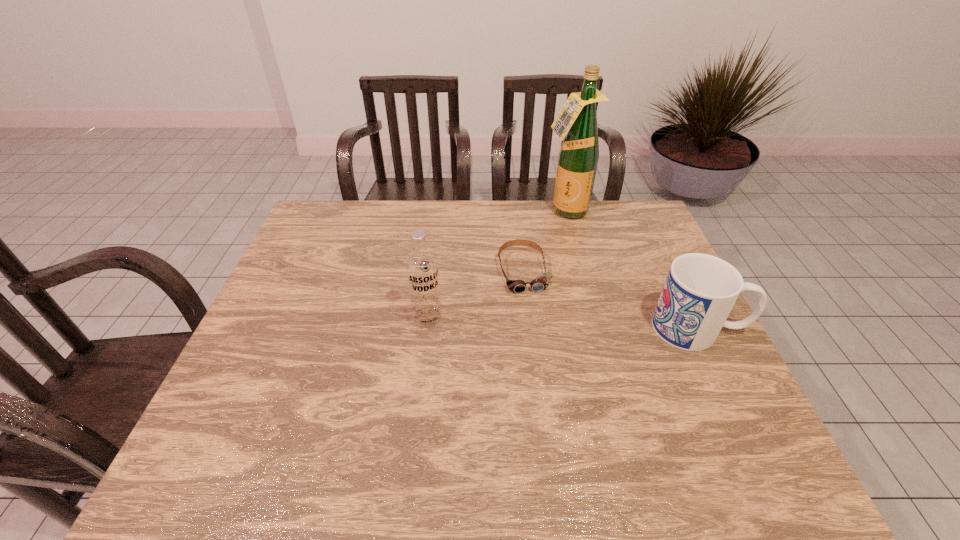
Locate an element on the screen. vacant space on the desktop that is between the leftmost object and the rightmost object and is positioned on the front-facing side of the goggles is located at coordinates click(538, 322).

Where is `free spot on the desktop that is between the third shortest object and the rightmost object and is positioned on the front-facing side of the liquor`? free spot on the desktop that is between the third shortest object and the rightmost object and is positioned on the front-facing side of the liquor is located at coordinates (574, 323).